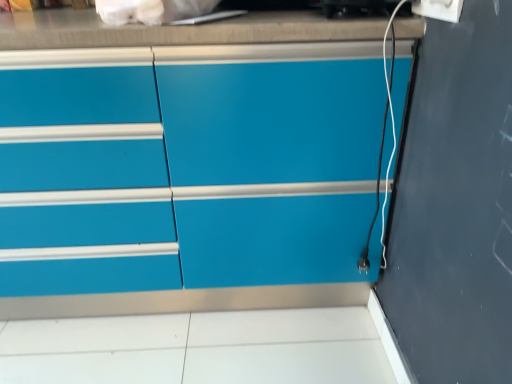
Where is `white plastic electric outlet at upper right`? white plastic electric outlet at upper right is located at coordinates (439, 9).

Describe the element at coordinates (439, 9) in the screenshot. I see `white plastic electric outlet at upper right` at that location.

Measure the distance between point (430, 5) and camera.

Point (430, 5) is 35.67 inches from camera.

This screenshot has height=384, width=512. What do you see at coordinates (187, 178) in the screenshot?
I see `matte blue cabinet at center` at bounding box center [187, 178].

The image size is (512, 384). I want to click on matte blue cabinet at center, so click(187, 178).

You are a GUI agent. You are given a task and a screenshot of the screen. Output one action in this format:
    pyautogui.click(x=<x>, y=<y>)
    Task: Click on the white plastic electric outlet at upper right
    The height and width of the screenshot is (384, 512).
    Given the screenshot: What is the action you would take?
    pyautogui.click(x=439, y=9)

Can you confirm if matte blue cabinet at center is positioned to the right of white plastic electric outlet at upper right?

Incorrect, matte blue cabinet at center is not on the right side of white plastic electric outlet at upper right.

Is matte blue cabinet at center closer to the viewer compared to white plastic electric outlet at upper right?

No.

Is point (124, 260) farther from camera compared to point (433, 6)?

Yes, it is.

From the image's perspective, who appears lower, matte blue cabinet at center or white plastic electric outlet at upper right?

matte blue cabinet at center appears lower in the image.

From a real-world perspective, between matte blue cabinet at center and white plastic electric outlet at upper right, who is vertically higher?

From a 3D spatial view, white plastic electric outlet at upper right is above.

In terms of width, does matte blue cabinet at center look wider or thinner when compared to white plastic electric outlet at upper right?

Clearly, matte blue cabinet at center has more width compared to white plastic electric outlet at upper right.

Considering the sizes of objects matte blue cabinet at center and white plastic electric outlet at upper right in the image provided, who is taller, matte blue cabinet at center or white plastic electric outlet at upper right?

matte blue cabinet at center is taller.

Can you confirm if matte blue cabinet at center is bigger than white plastic electric outlet at upper right?

Correct, matte blue cabinet at center is larger in size than white plastic electric outlet at upper right.

Can white plastic electric outlet at upper right be found inside matte blue cabinet at center?

No.

Are matte blue cabinet at center and white plastic electric outlet at upper right located far from each other?

No, matte blue cabinet at center is not far away from white plastic electric outlet at upper right.

Is matte blue cabinet at center positioned with its back to white plastic electric outlet at upper right?

No, matte blue cabinet at center is not facing the opposite direction of white plastic electric outlet at upper right.

The height and width of the screenshot is (384, 512). What are the coordinates of `electric outlet on the right of matte blue cabinet at center` in the screenshot? It's located at (439, 9).

Considering the relative positions of white plastic electric outlet at upper right and matte blue cabinet at center in the image provided, is white plastic electric outlet at upper right to the left or to the right of matte blue cabinet at center?

white plastic electric outlet at upper right is to the right of matte blue cabinet at center.

Relative to matte blue cabinet at center, is white plastic electric outlet at upper right in front or behind?

white plastic electric outlet at upper right is positioned closer to the viewer than matte blue cabinet at center.

Does point (454, 2) come farther from viewer compared to point (148, 285)?

No, it is in front of (148, 285).

From the image's perspective, relative to matte blue cabinet at center, is white plastic electric outlet at upper right above or below?

Based on their image positions, white plastic electric outlet at upper right is located above matte blue cabinet at center.

From a real-world perspective, is white plastic electric outlet at upper right below matte blue cabinet at center?

No.

Between white plastic electric outlet at upper right and matte blue cabinet at center, which one has smaller width?

With smaller width is white plastic electric outlet at upper right.

Who is shorter, white plastic electric outlet at upper right or matte blue cabinet at center?

white plastic electric outlet at upper right is shorter.

Between white plastic electric outlet at upper right and matte blue cabinet at center, which one has larger size?

matte blue cabinet at center is bigger.

Is matte blue cabinet at center completely or partially inside white plastic electric outlet at upper right?

No.

Is white plastic electric outlet at upper right next to matte blue cabinet at center?

No, white plastic electric outlet at upper right is not beside matte blue cabinet at center.

Could you tell me if white plastic electric outlet at upper right is turned towards matte blue cabinet at center?

No.

This screenshot has width=512, height=384. I want to click on electric outlet above the matte blue cabinet at center (from a real-world perspective), so [x=439, y=9].

In order to click on electric outlet that appears in front of the matte blue cabinet at center in this screenshot , I will do `click(439, 9)`.

At what (x,y) coordinates should I click in order to perform the action: click on chest of drawers below the white plastic electric outlet at upper right (from a real-world perspective). Please return your answer as a coordinate pair (x, y). This screenshot has width=512, height=384. Looking at the image, I should click on (187, 178).